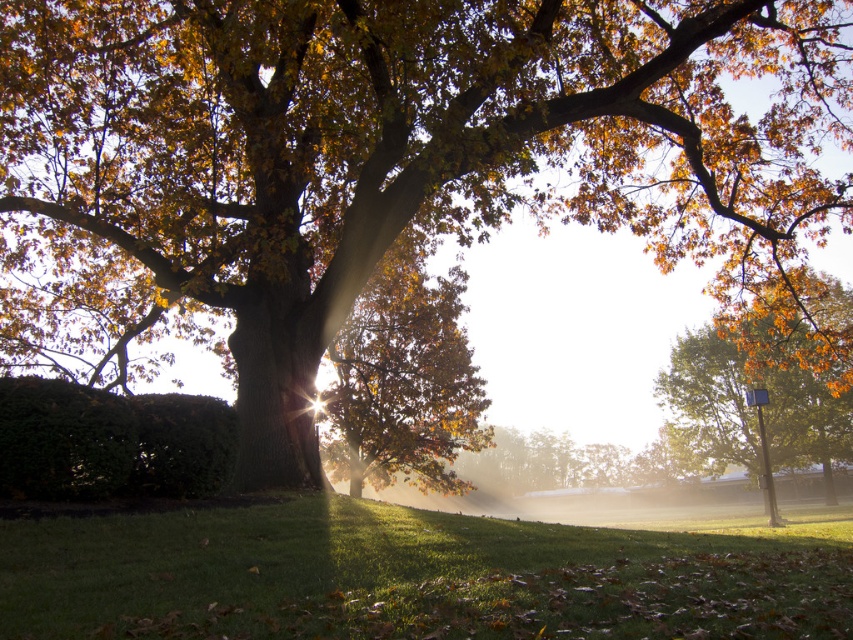
You are standing at the base of the large tree in the autumnal scene. Looking towards the point marked by coordinates point (405, 577), what do you see there?

The point (405, 577) marks green grassy at lower center, so you see green grassy at lower center there.

You are standing at point (405,577) in the image. Based on the scene description, what is the immediate surface beneath your feet?

The immediate surface beneath your feet at point (405,577) is green grassy at lower center, as indicated by the Objects Description.